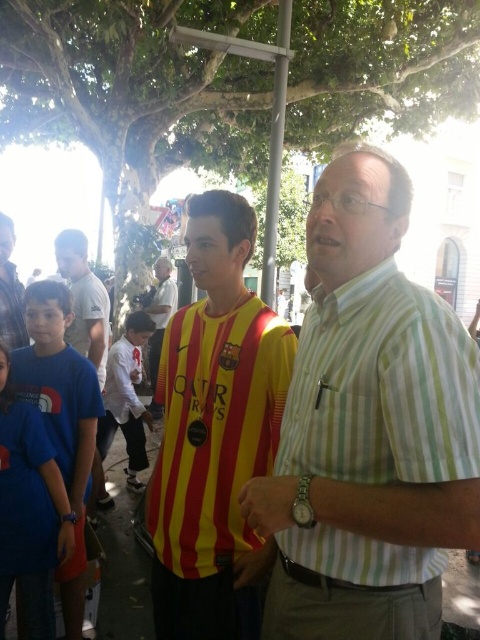
You are standing at the point with coordinates point (x=22, y=337) and want to walk towards the point with coordinates point (x=27, y=413). According to the scene, will you be moving forward or backward?

Point (x=27, y=413) is in front of point (x=22, y=337), so moving towards it would mean moving forward.

You are standing at the viewer position in the scene. There is a point at coordinates point (45, 436). Can you reach that point without moving more than 8 feet?

The distance between point (45, 436) and the viewer is 7.71 feet, so yes, you can reach it without moving more than 8 feet.